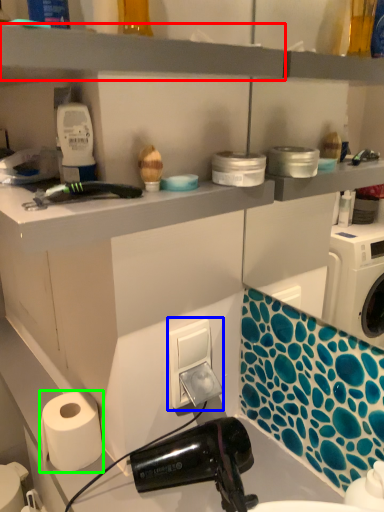
Question: Based on their relative distances, which object is farther from shelf (highlighted by a red box)? Choose from electric outlet (highlighted by a blue box) and paper towel (highlighted by a green box).

Choices:
 (A) electric outlet
 (B) paper towel

Answer: (B)